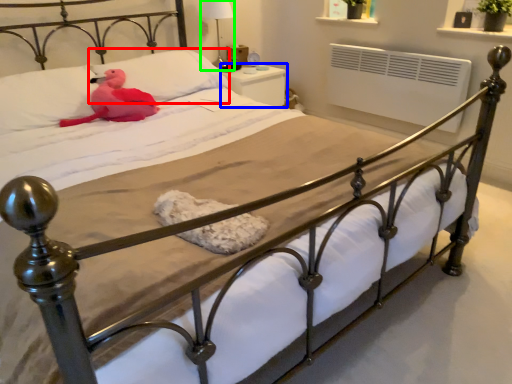
Question: Considering the real-world distances, which object is closest to pillow (highlighted by a red box)? nightstand (highlighted by a blue box) or table lamp (highlighted by a green box).

Choices:
 (A) nightstand
 (B) table lamp

Answer: (A)